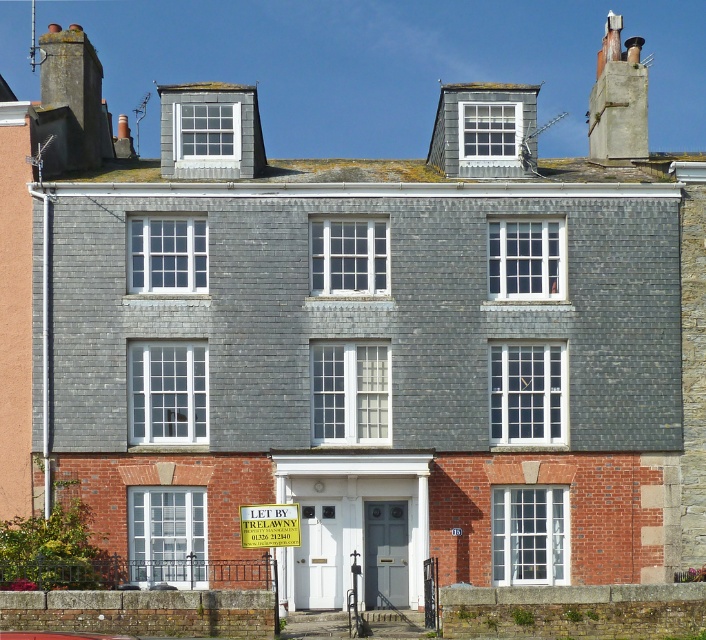
Question: Estimate the real-world distances between objects in this image. Which object is farther from the yellow paper sign at center?

Choices:
 (A) concrete chimney at upper right
 (B) smooth stone chimney at upper left

Answer: (A)

Question: Is concrete chimney at upper right wider than yellow paper sign at center?

Choices:
 (A) no
 (B) yes

Answer: (B)

Question: Is concrete chimney at upper right to the right of yellow paper sign at center from the viewer's perspective?

Choices:
 (A) yes
 (B) no

Answer: (A)

Question: Which is farther from the smooth stone chimney at upper left?

Choices:
 (A) concrete chimney at upper right
 (B) yellow paper sign at center

Answer: (A)

Question: Among these points, which one is farthest from the camera?

Choices:
 (A) (633, 141)
 (B) (241, 522)

Answer: (A)

Question: Can you confirm if concrete chimney at upper right is bigger than yellow paper sign at center?

Choices:
 (A) yes
 (B) no

Answer: (A)